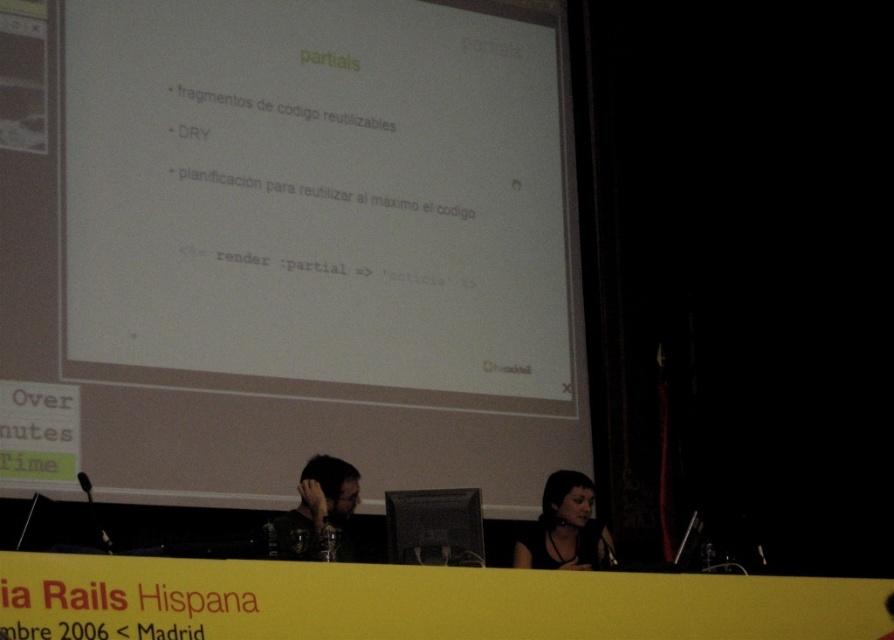
You are an attendee at the conference and want to take a photo of the white matte projection screen at center and the black leather hair at center. Which object should you focus on first if you want to capture both in a single frame without moving the camera?

The white matte projection screen at center is taller than the black leather hair at center, so you should focus on the white matte projection screen at center first to ensure it fits within the frame.

Consider the image. You are an attendee at this conference and notice two people sitting at the table. One has black leather hair at center and the other has matte black hair at center. From your perspective, which person is sitting closer to the projection screen?

The black leather hair at center is positioned under matte black hair at center, so the person with the matte black hair at center is closer to the projection screen.

You are a participant in the presentation and want to know which of the two points the speaker is pointing at. The speaker is pointing at two points on the screen. Which point is closer to the camera? The points are point (568, 531) and point (335, 500).

Point (568, 531) is further to the camera than point (335, 500), so the point closer to the camera is point (335, 500).